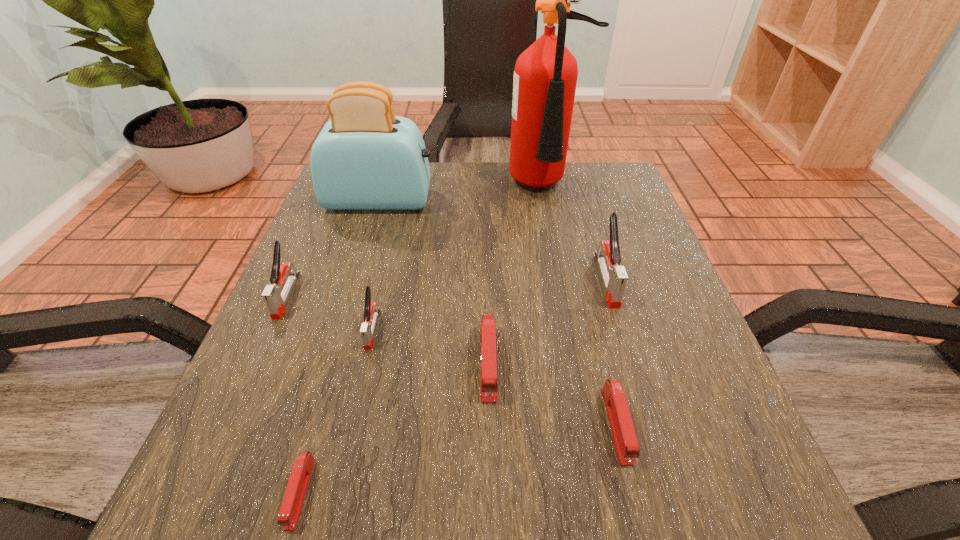
This screenshot has height=540, width=960. I want to click on blank space located on the handle side of the fourth shortest stapler, so click(x=352, y=415).

The height and width of the screenshot is (540, 960). What are the coordinates of `vacant space located 0.090m on the front-facing side of the second red stapler from left to right` in the screenshot? It's located at (491, 463).

Find the location of `vacant region located 0.050m on the front-facing side of the rightmost red stapler`. vacant region located 0.050m on the front-facing side of the rightmost red stapler is located at coordinates pyautogui.click(x=636, y=506).

Locate an element on the screen. fire extinguisher located in the far edge section of the desktop is located at coordinates (545, 75).

Identify the location of toaster that is positioned at the far edge. The image size is (960, 540). (365, 158).

The image size is (960, 540). I want to click on toaster situated at the left edge, so click(365, 158).

Locate an element on the screen. fire extinguisher that is at the right edge is located at coordinates (545, 75).

Where is `stapler positioned at the right edge`? This screenshot has height=540, width=960. stapler positioned at the right edge is located at coordinates (614, 276).

I want to click on object that is at the far left corner, so click(x=365, y=158).

I want to click on object at the near left corner, so click(291, 506).